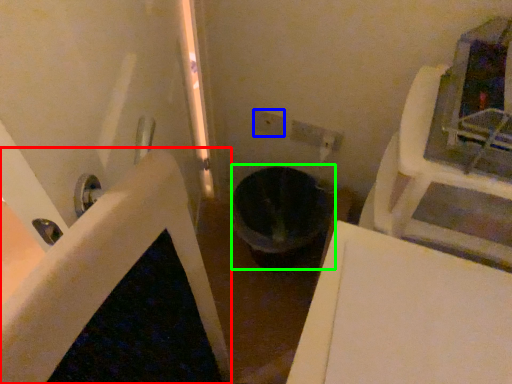
Question: Considering the real-world distances, which object is farthest from bath (highlighted by a red box)? electric outlet (highlighted by a blue box) or toilet bowl (highlighted by a green box)?

Choices:
 (A) electric outlet
 (B) toilet bowl

Answer: (A)